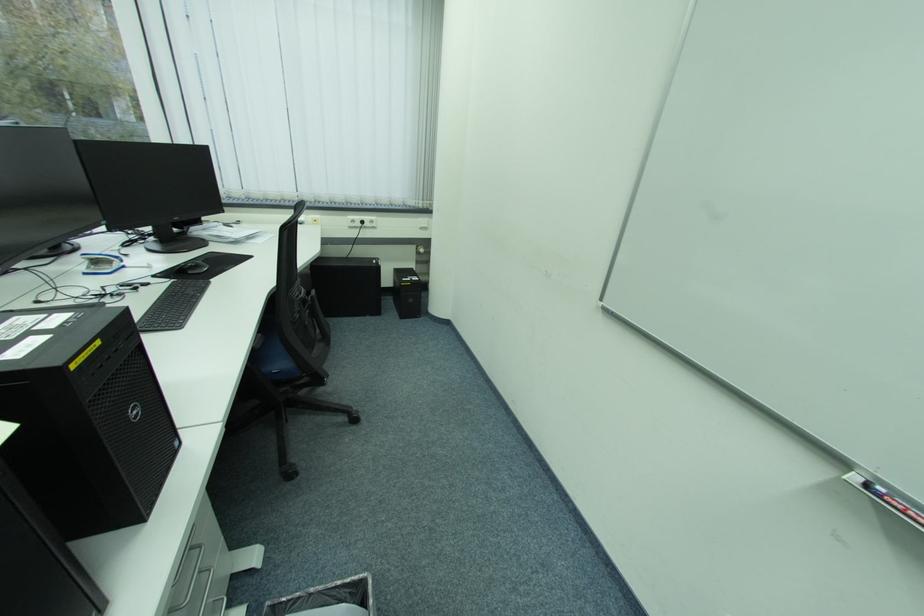
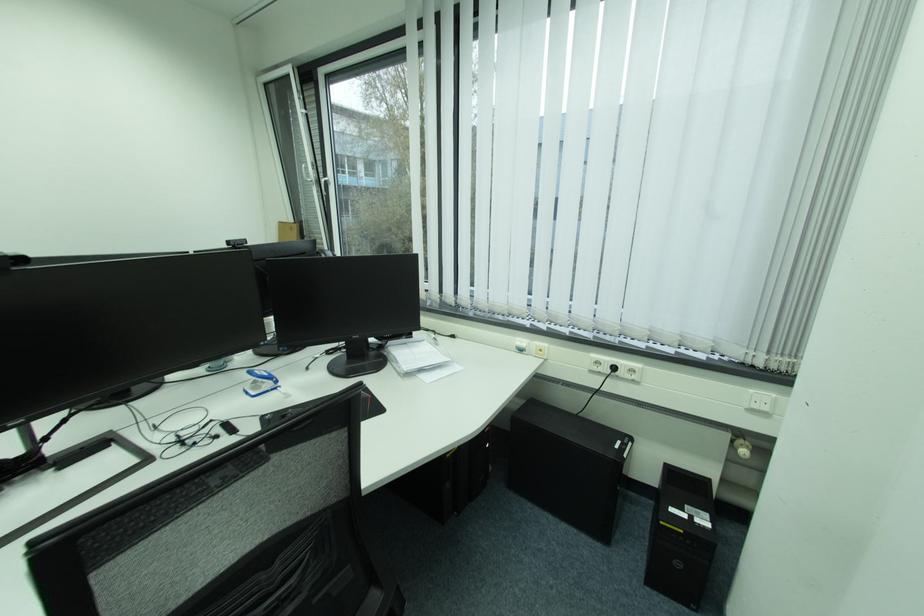
In the second image, find the point that corresponds to [124,264] in the first image.

(275, 386)